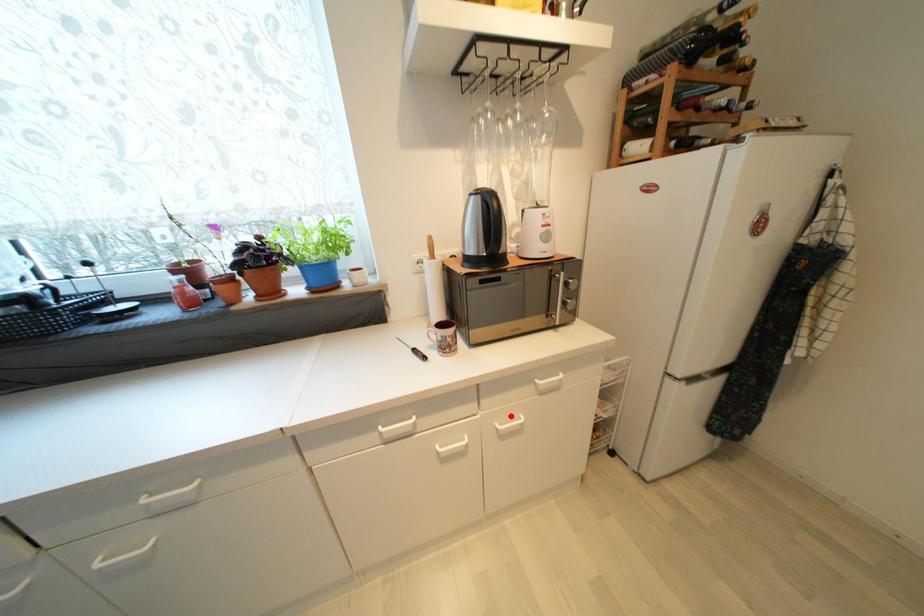
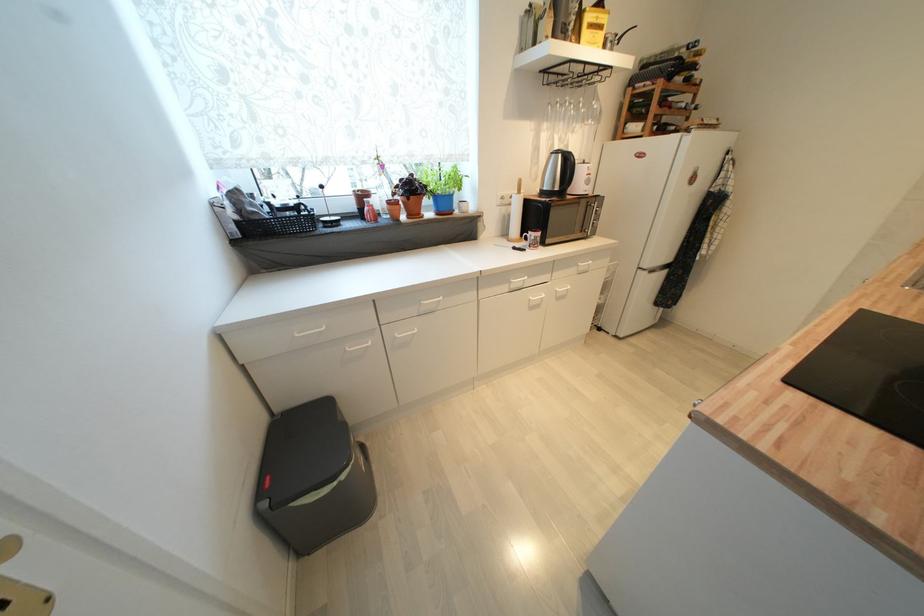
Question: I am providing you with two images of the same scene from different viewpoints. Image1 has a red point marked. In image2, the corresponding 3D location appears at what relative position? Reply with the corresponding letter.

Choices:
 (A) Closer
 (B) Farther

Answer: (A)